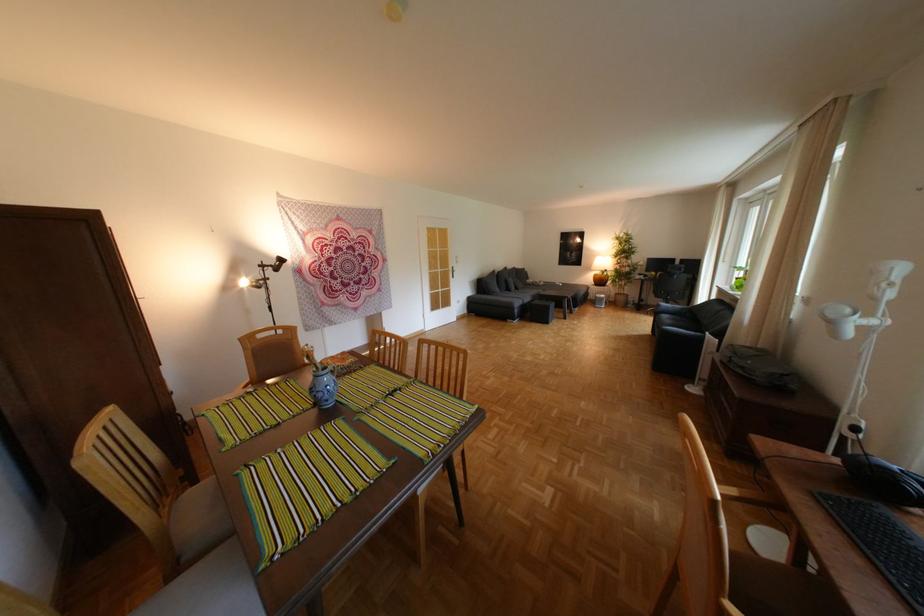
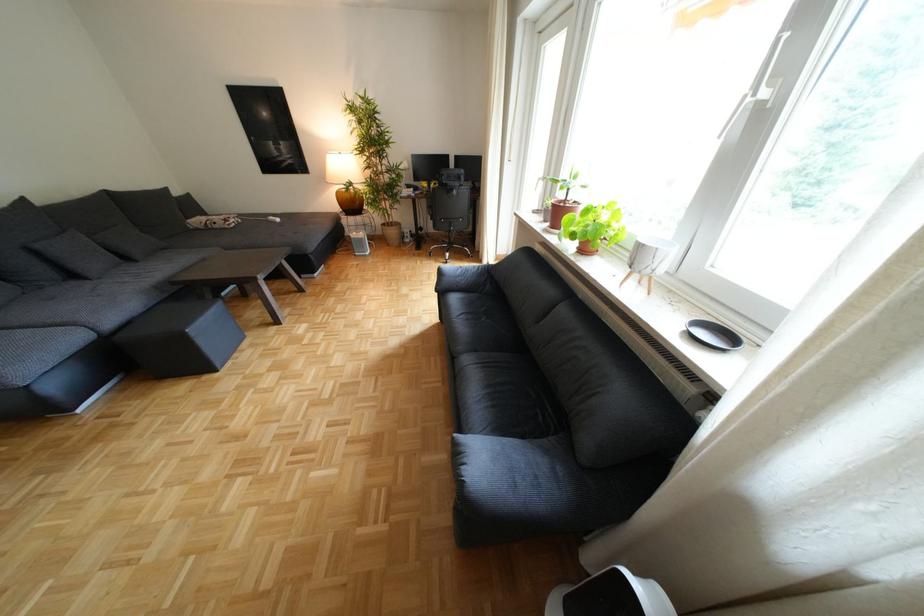
Find the pixel in the second image that matches point (608, 275) in the first image.

(351, 193)